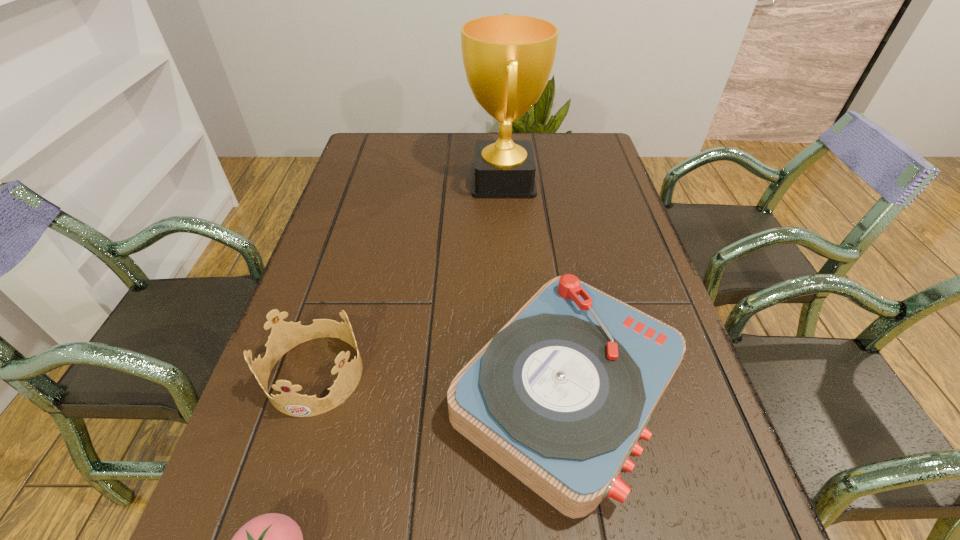
Locate an element on the screen. vacant area in the image that satisfies the following two spatial constraints: 1. on the front-facing side of the farthest object; 2. on the front-facing side of the tiara is located at coordinates (516, 374).

The image size is (960, 540). Find the location of `vacant area in the image that satisfies the following two spatial constraints: 1. on the front-facing side of the record player; 2. on the right side of the award`. vacant area in the image that satisfies the following two spatial constraints: 1. on the front-facing side of the record player; 2. on the right side of the award is located at coordinates [517, 393].

Image resolution: width=960 pixels, height=540 pixels. Identify the location of free region that satisfies the following two spatial constraints: 1. on the front-facing side of the award; 2. on the front-facing side of the tiara. (516, 374).